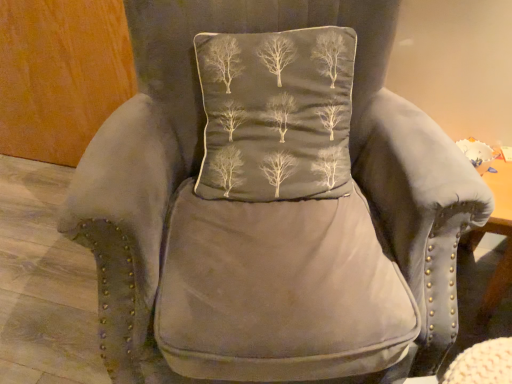
What do you see at coordinates (276, 114) in the screenshot?
I see `gray fabric cushion with tree pattern at center` at bounding box center [276, 114].

Find the location of a particular element. The width and height of the screenshot is (512, 384). gray fabric cushion with tree pattern at center is located at coordinates (276, 114).

At what (x,y) coordinates should I click in order to perform the action: click on gray fabric cushion with tree pattern at center. Please return your answer as a coordinate pair (x, y). The height and width of the screenshot is (384, 512). Looking at the image, I should click on (276, 114).